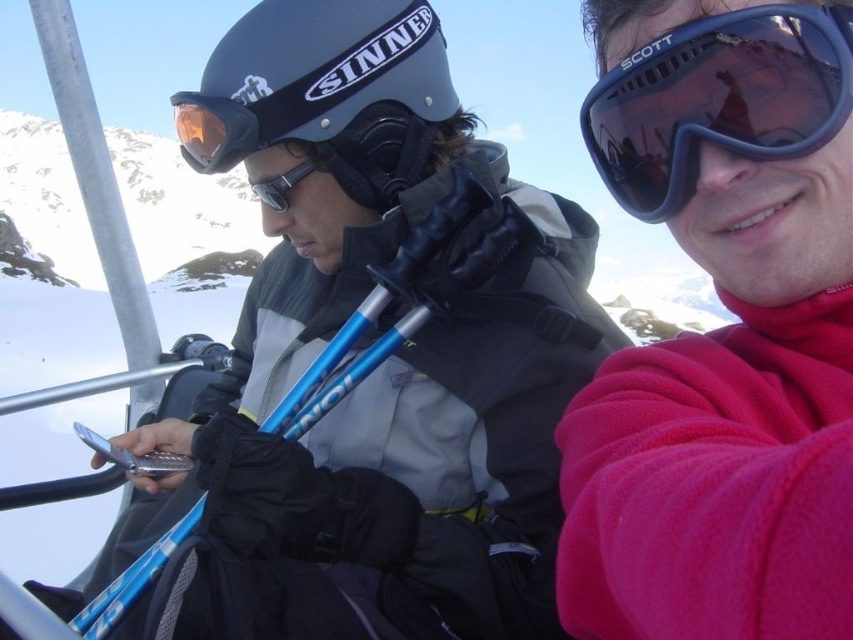
Which is more to the left, matte black helmet at center or blue metallic ski pole at left?

blue metallic ski pole at left

Who is taller, matte black helmet at center or blue metallic ski pole at left?

blue metallic ski pole at left is taller.

The height and width of the screenshot is (640, 853). Find the location of `matte black helmet at center`. matte black helmet at center is located at coordinates [x=317, y=72].

Is dark blue plastic goggles at upper right to the left of matte black helmet at center from the viewer's perspective?

In fact, dark blue plastic goggles at upper right is to the right of matte black helmet at center.

Is dark blue plastic goggles at upper right closer to camera compared to matte black helmet at center?

Yes.

Which is in front, point (846, 92) or point (273, 132)?

Positioned in front is point (846, 92).

Identify the location of dark blue plastic goggles at upper right. (718, 99).

Who is taller, dark blue plastic goggles at upper right or blue metallic ski pole at left?

blue metallic ski pole at left is taller.

Between point (664, 140) and point (94, 604), which one is positioned in front?

Positioned in front is point (664, 140).

Describe the element at coordinates (718, 99) in the screenshot. I see `dark blue plastic goggles at upper right` at that location.

Identify the location of dark blue plastic goggles at upper right. (718, 99).